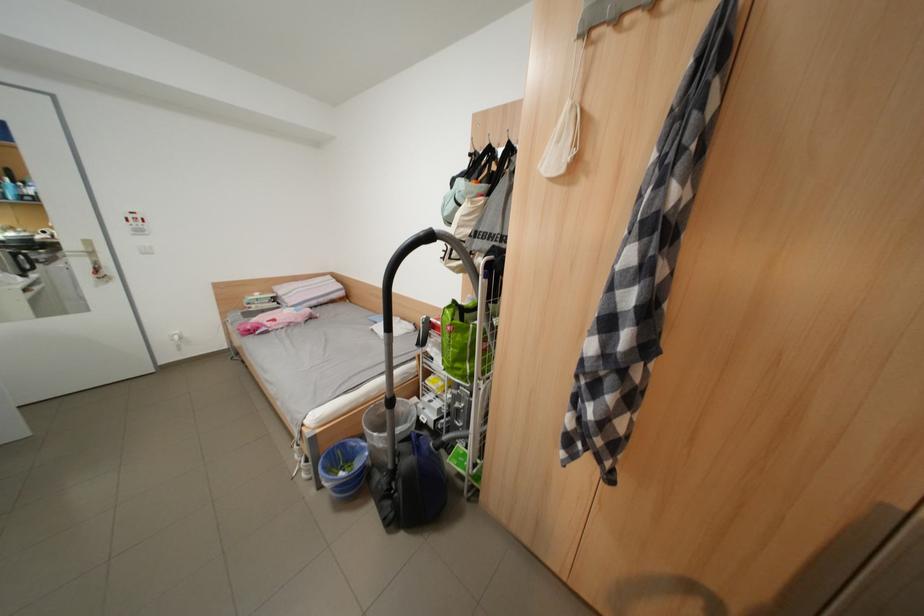
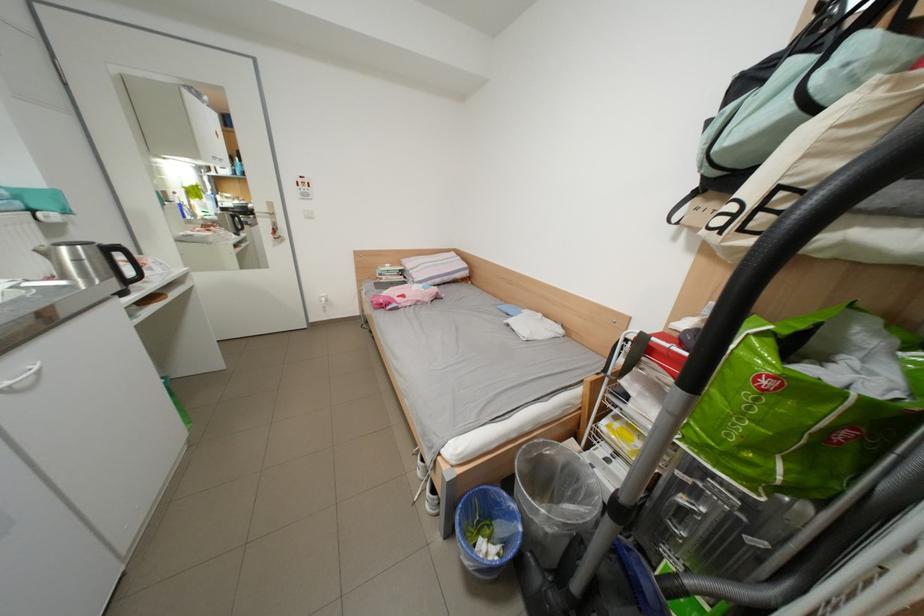
The point at (466, 363) is marked in the first image. Where is the corresponding point in the second image?

(754, 448)